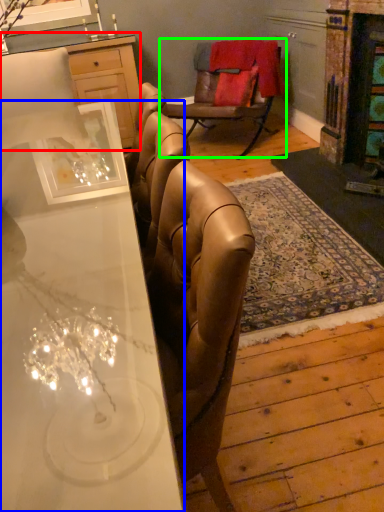
Question: Which object is the farthest from cabinetry (highlighted by a red box)? Choose among these: desk (highlighted by a blue box) or chair (highlighted by a green box).

Choices:
 (A) desk
 (B) chair

Answer: (A)